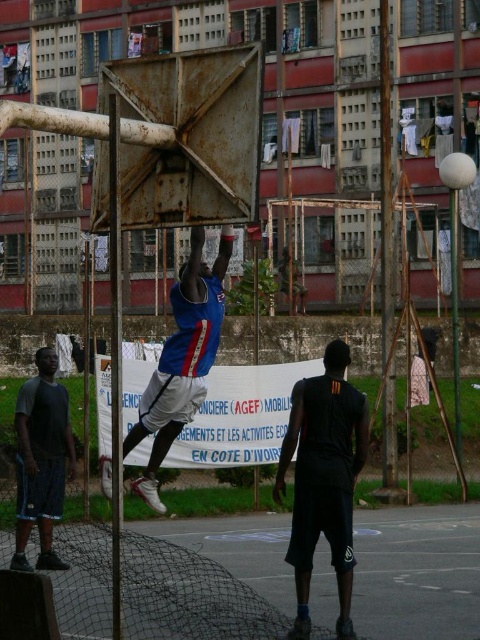
Question: Which of these objects is positioned closest to the black matte shorts at lower right?

Choices:
 (A) blue jersey at center
 (B) dark gray fabric shorts at lower left

Answer: (A)

Question: Can you confirm if black matte shorts at lower right is positioned to the left of blue jersey at center?

Choices:
 (A) yes
 (B) no

Answer: (B)

Question: Which of the following is the closest to the observer?

Choices:
 (A) black matte shorts at lower right
 (B) blue jersey at center

Answer: (B)

Question: Can you confirm if black matte shorts at lower right is bigger than dark gray fabric shorts at lower left?

Choices:
 (A) yes
 (B) no

Answer: (B)

Question: Is black matte shorts at lower right wider than dark gray fabric shorts at lower left?

Choices:
 (A) no
 (B) yes

Answer: (A)

Question: Which is farther from the black matte shorts at lower right?

Choices:
 (A) dark gray fabric shorts at lower left
 (B) blue jersey at center

Answer: (A)